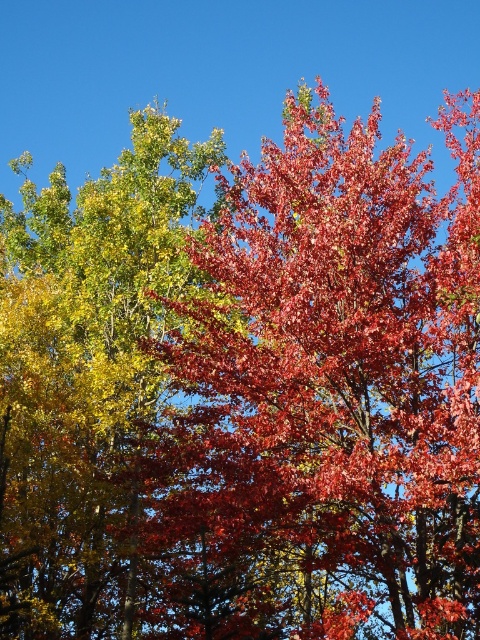
You are an artist trying to paint the autumn scene. You want to ensure the shiny red leaves at center and the shiny green leaves at upper left are proportionally accurate. Which of these leaves should you paint larger in your artwork?

The shiny red leaves at center should be painted larger than the shiny green leaves at upper left because they are described as having a larger size compared to the shiny green leaves at upper left.

You are standing in the autumn scene and want to walk from the point at coordinates point (210,502) to the point at coordinates point (66,424). Which direction should you move to get closer to your destination?

You should move backward because point (210,502) is in front of point (66,424), so moving backward will bring you closer to the destination.